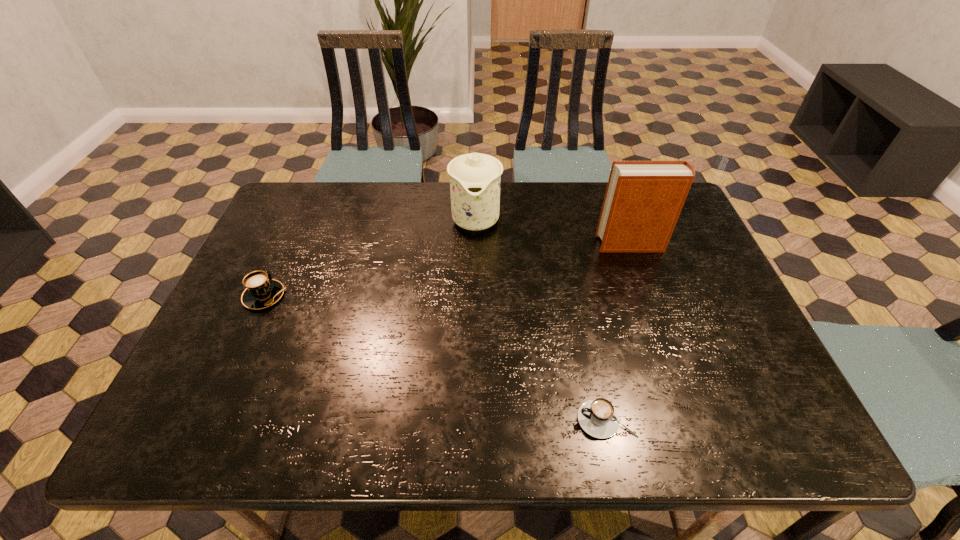
The image size is (960, 540). I want to click on vacant space located 0.080m on the right of the third tallest object, so click(x=317, y=296).

I want to click on blank area located 0.110m with the handle on the side of the third object from left to right, so click(x=523, y=420).

At what (x,y) coordinates should I click in order to perform the action: click on free space located 0.070m with the handle on the side of the third object from left to right. Please return your answer as a coordinate pair (x, y). The image size is (960, 540). Looking at the image, I should click on (543, 420).

I want to click on vacant region located with the handle on the side of the third object from left to right, so click(x=420, y=420).

At what (x,y) coordinates should I click in order to perform the action: click on object present at the far edge. Please return your answer as a coordinate pair (x, y). Looking at the image, I should click on (475, 178).

Find the location of a particular element. The width and height of the screenshot is (960, 540). object located in the near edge section of the desktop is located at coordinates (598, 418).

Find the location of a particular element. object present at the left edge is located at coordinates (261, 292).

Locate an element on the screen. object that is at the right edge is located at coordinates (643, 200).

Where is `free space at the far edge`? This screenshot has height=540, width=960. free space at the far edge is located at coordinates (520, 190).

This screenshot has width=960, height=540. I want to click on vacant space at the near edge of the desktop, so click(292, 413).